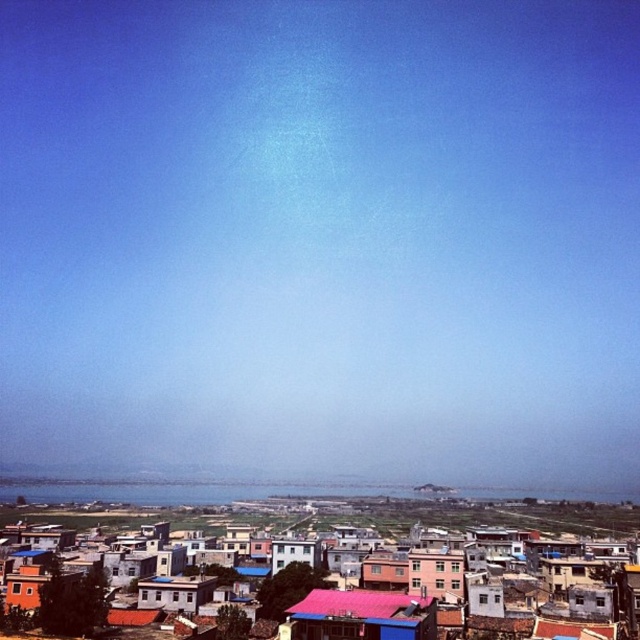
Question: Does pink matte building at center have a smaller size compared to blue corrugated metal hut at center?

Choices:
 (A) no
 (B) yes

Answer: (A)

Question: Is multicolored tiled roofs at center wider than pink matte building at center?

Choices:
 (A) yes
 (B) no

Answer: (A)

Question: Which point is closer to the camera taking this photo?

Choices:
 (A) (273, 561)
 (B) (304, 605)
 (C) (424, 552)
 (D) (145, 579)

Answer: (B)

Question: Which object is the closest to the white painted wood hut at center?

Choices:
 (A) blue corrugated metal hut at center
 (B) multicolored tiled roofs at center

Answer: (A)

Question: Does red corrugated metal roof at center lie behind white painted wood hut at center?

Choices:
 (A) no
 (B) yes

Answer: (A)

Question: Which point is closer to the camera?

Choices:
 (A) (72, 512)
 (B) (138, 600)

Answer: (B)